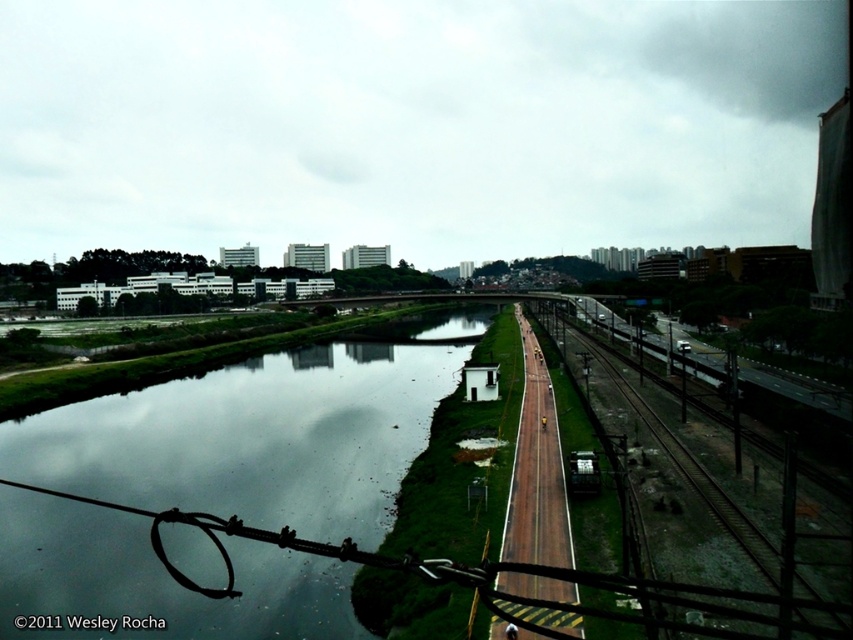
Question: Is reflective glass water at center further to the viewer compared to brown wooden train track at center?

Choices:
 (A) no
 (B) yes

Answer: (B)

Question: Which point appears farthest from the camera in this image?

Choices:
 (A) (160, 435)
 (B) (555, 342)

Answer: (B)

Question: Which point is farther to the camera?

Choices:
 (A) (753, 548)
 (B) (233, 618)

Answer: (A)

Question: Is reflective glass water at center positioned in front of brown wooden train track at center?

Choices:
 (A) yes
 (B) no

Answer: (B)

Question: Considering the relative positions of reflective glass water at center and brown wooden train track at center in the image provided, where is reflective glass water at center located with respect to brown wooden train track at center?

Choices:
 (A) above
 (B) below

Answer: (B)